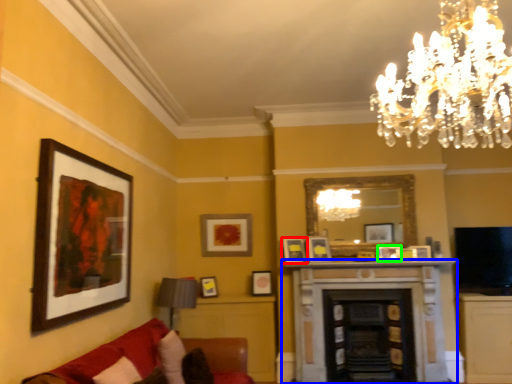
Question: Which is nearer to the picture frame (highlighted by a red box)? fireplace (highlighted by a blue box) or picture frame (highlighted by a green box).

Choices:
 (A) fireplace
 (B) picture frame

Answer: (A)